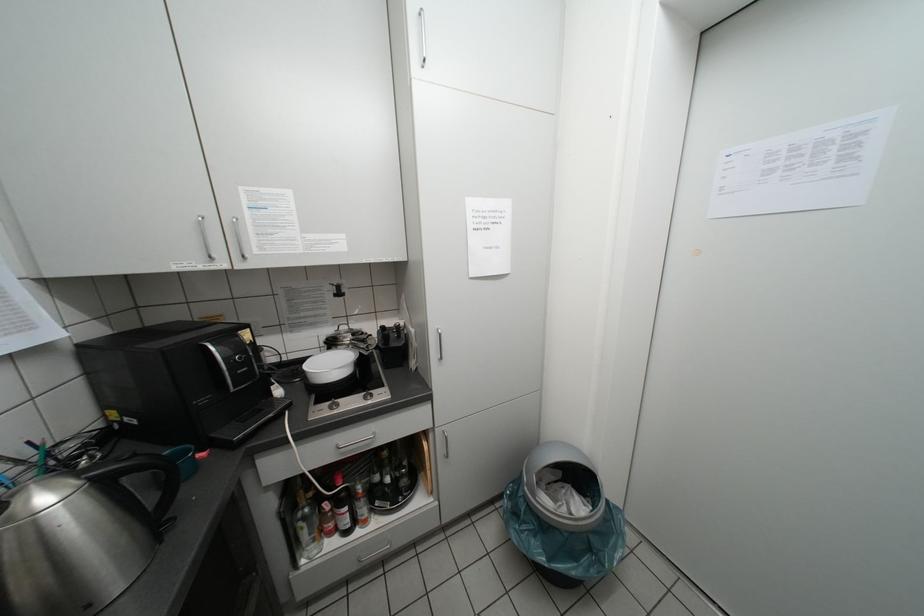
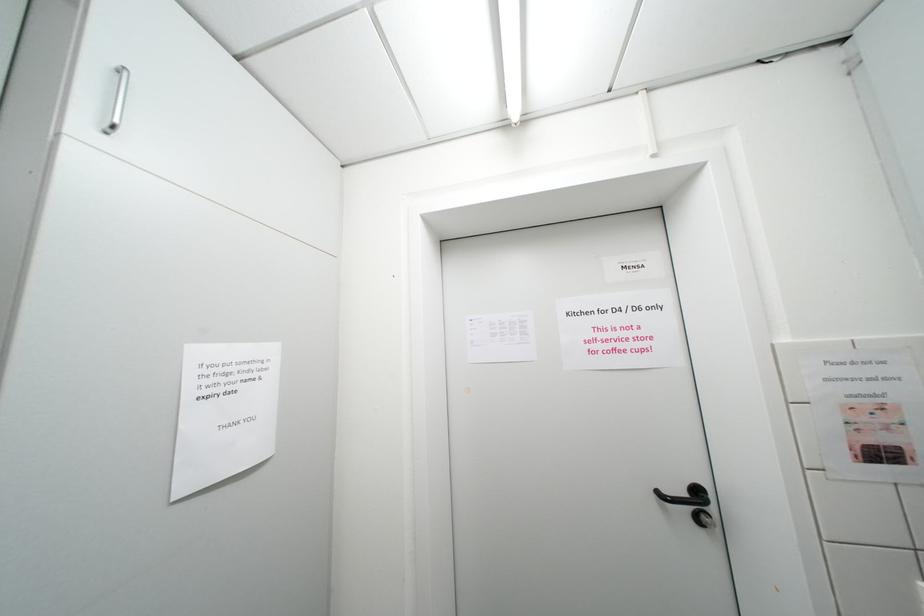
The first image is from the beginning of the video and the second image is from the end. How did the camera likely rotate when shooting the video?

The camera rotated toward right-up.